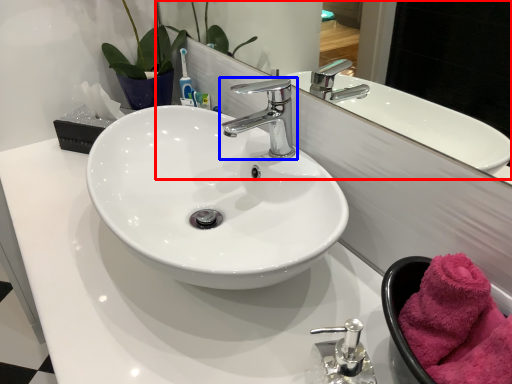
Question: Which object appears farthest to the camera in this image, mirror (highlighted by a red box) or tap (highlighted by a blue box)?

Choices:
 (A) mirror
 (B) tap

Answer: (B)